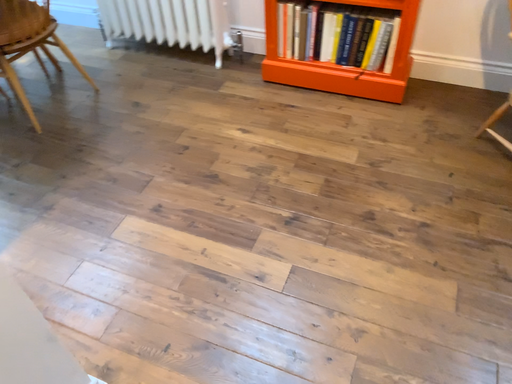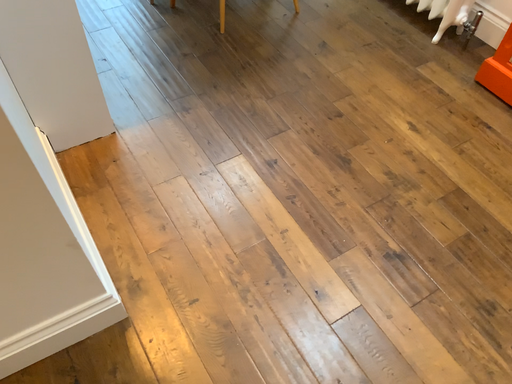
Question: Which way did the camera rotate in the video?

Choices:
 (A) rotated right
 (B) rotated left

Answer: (B)